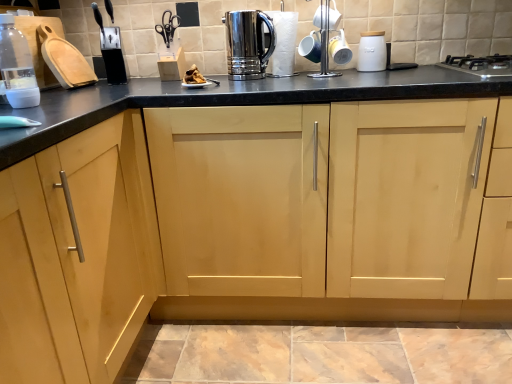
Question: Does white matte bottle at left come behind polished stainless steel coffee pot at upper center, the 3th appliance in the right-to-left sequence?

Choices:
 (A) yes
 (B) no

Answer: (B)

Question: From a real-world perspective, does white matte bottle at left stand above polished stainless steel coffee pot at upper center, the 2th appliance from the left?

Choices:
 (A) yes
 (B) no

Answer: (B)

Question: Are white matte bottle at left and polished stainless steel coffee pot at upper center, the 3th appliance in the right-to-left sequence, located far from each other?

Choices:
 (A) yes
 (B) no

Answer: (B)

Question: Is white matte bottle at left taller than polished stainless steel coffee pot at upper center, the 2th appliance from the left?

Choices:
 (A) no
 (B) yes

Answer: (A)

Question: Does white matte bottle at left have a lesser width compared to polished stainless steel coffee pot at upper center, the 2th appliance from the left?

Choices:
 (A) no
 (B) yes

Answer: (B)

Question: From their relative heights in the image, would you say natural wood cabinet at center is taller or shorter than black stainless steel gas stove at upper right?

Choices:
 (A) short
 (B) tall

Answer: (B)

Question: Is natural wood cabinet at center inside the boundaries of black stainless steel gas stove at upper right, or outside?

Choices:
 (A) outside
 (B) inside

Answer: (A)

Question: Is natural wood cabinet at center to the left or to the right of black stainless steel gas stove at upper right in the image?

Choices:
 (A) right
 (B) left

Answer: (B)

Question: From the image's perspective, relative to black stainless steel gas stove at upper right, is natural wood cabinet at center above or below?

Choices:
 (A) below
 (B) above

Answer: (A)

Question: From a real-world perspective, is black plastic knife block at upper left, the 4th appliance viewed from the right, positioned above or below white ceramic jar at upper right, which is counted as the 1th appliance, starting from the right?

Choices:
 (A) above
 (B) below

Answer: (A)

Question: Is black plastic knife block at upper left, the 4th appliance viewed from the right, to the left or to the right of white ceramic jar at upper right, which is counted as the 1th appliance, starting from the right, in the image?

Choices:
 (A) right
 (B) left

Answer: (B)

Question: From their relative heights in the image, would you say black plastic knife block at upper left, the first appliance from the left, is taller or shorter than white ceramic jar at upper right, positioned as the fourth appliance in left-to-right order?

Choices:
 (A) short
 (B) tall

Answer: (B)

Question: Is black plastic knife block at upper left, the 4th appliance viewed from the right, bigger or smaller than white ceramic jar at upper right, positioned as the fourth appliance in left-to-right order?

Choices:
 (A) small
 (B) big

Answer: (B)

Question: In terms of width, does white matte bottle at left look wider or thinner when compared to black plastic knife block at upper left, the 4th appliance viewed from the right?

Choices:
 (A) wide
 (B) thin

Answer: (B)

Question: Is point (25, 59) closer or farther from the camera than point (96, 19)?

Choices:
 (A) farther
 (B) closer

Answer: (B)